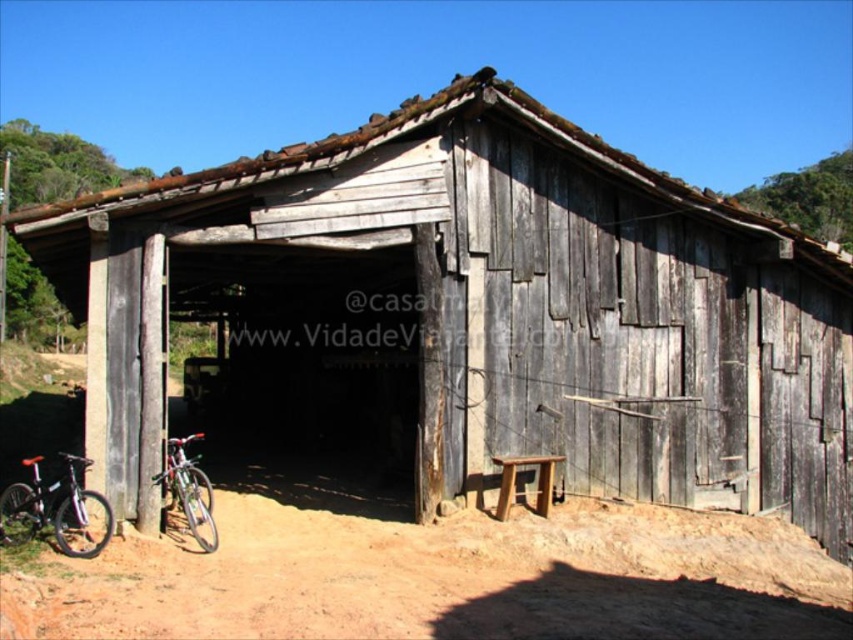
Question: Where is shiny black bicycle at lower left located in relation to wooden stool at lower center in the image?

Choices:
 (A) left
 (B) right

Answer: (A)

Question: Which point is farther to the camera?

Choices:
 (A) (791, 589)
 (B) (74, 520)
 (C) (547, 496)
 (D) (164, 481)

Answer: (C)

Question: Does brown dirt track at lower left appear on the right side of wooden stool at lower center?

Choices:
 (A) no
 (B) yes

Answer: (B)

Question: Which of the following is the farthest from the observer?

Choices:
 (A) (86, 524)
 (B) (173, 456)
 (C) (550, 632)

Answer: (B)

Question: Which object is farther from the camera taking this photo?

Choices:
 (A) wooden stool at lower center
 (B) shiny black bicycle at lower left
 (C) brown dirt track at lower left
 (D) shiny metallic bicycle at lower left

Answer: (C)

Question: Does brown dirt track at lower left have a smaller size compared to wooden stool at lower center?

Choices:
 (A) yes
 (B) no

Answer: (A)